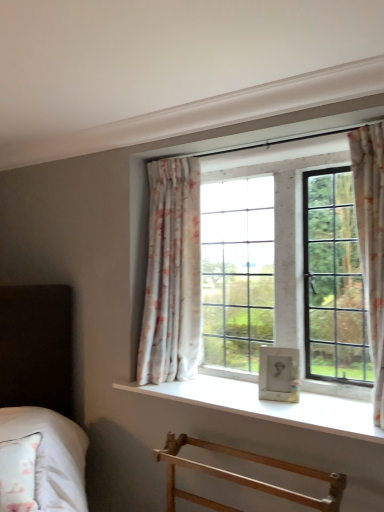
The height and width of the screenshot is (512, 384). What are the coordinates of `vacant space situated on the left part of floral fabric curtain at right, which ranks as the first curtain in right-to-left order` in the screenshot? It's located at (329, 418).